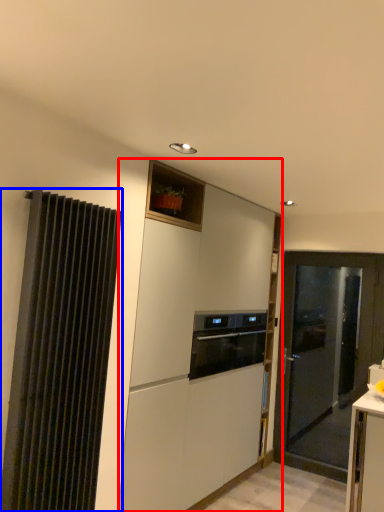
Question: Which of the following is the farthest to the observer, cabinetry (highlighted by a red box) or curtain (highlighted by a blue box)?

Choices:
 (A) cabinetry
 (B) curtain

Answer: (A)